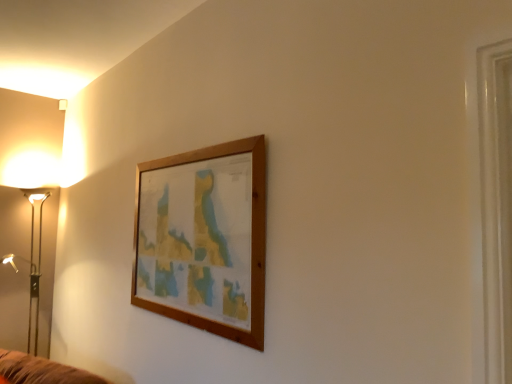
Describe the element at coordinates (27, 250) in the screenshot. The image size is (512, 384). I see `metallic gold floor lamp at left` at that location.

Locate an element on the screen. The image size is (512, 384). metallic gold floor lamp at left is located at coordinates (27, 250).

At what (x,y) coordinates should I click in order to perform the action: click on metallic gold floor lamp at left. Please return your answer as a coordinate pair (x, y). The image size is (512, 384). Looking at the image, I should click on pyautogui.click(x=27, y=250).